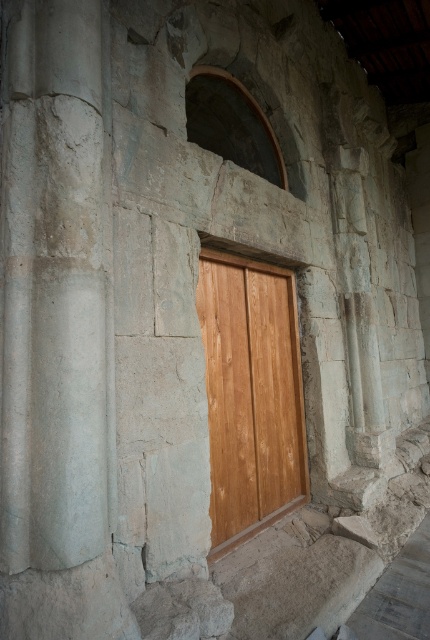
Question: Which of the following is the farthest from the observer?

Choices:
 (A) light brown wood door at center
 (B) smooth concrete column at left

Answer: (A)

Question: Which point appears closest to the camera in this image?

Choices:
 (A) (61, 96)
 (B) (254, 314)

Answer: (A)

Question: Does smooth concrete column at left appear on the right side of light brown wood door at center?

Choices:
 (A) no
 (B) yes

Answer: (A)

Question: Which of the following is the closest to the observer?

Choices:
 (A) (283, 460)
 (B) (31, 24)

Answer: (B)

Question: From the image, what is the correct spatial relationship of smooth concrete column at left in relation to light brown wood door at center?

Choices:
 (A) below
 (B) above

Answer: (B)

Question: Can you confirm if smooth concrete column at left is thinner than light brown wood door at center?

Choices:
 (A) yes
 (B) no

Answer: (A)